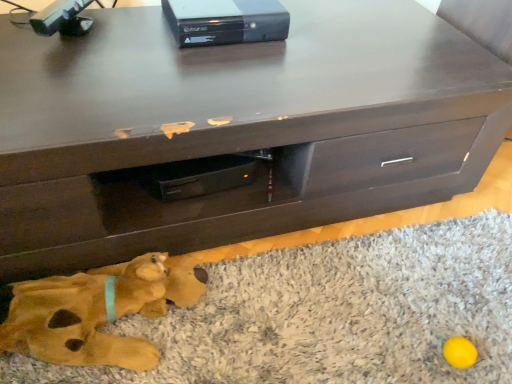
Locate an element on the screen. This screenshot has height=384, width=512. dark wood chest of drawers at center is located at coordinates (234, 128).

This screenshot has width=512, height=384. I want to click on soft plush dog at lower left, so click(96, 313).

Considering the sizes of objects soft plush dog at lower left and black plastic game console at upper center in the image provided, who is smaller, soft plush dog at lower left or black plastic game console at upper center?

With smaller size is black plastic game console at upper center.

From a real-world perspective, who is located lower, soft plush dog at lower left or black plastic game console at upper center?

From a 3D spatial view, soft plush dog at lower left is below.

In the scene shown: How many degrees apart are the facing directions of soft plush dog at lower left and black plastic game console at upper center?

There is a 1.21-degree angle between the facing directions of soft plush dog at lower left and black plastic game console at upper center.

From the image's perspective, between soft plush dog at lower left and black plastic game console at upper center, who is located below?

soft plush dog at lower left appears lower in the image.

Based on the photo, is soft plush rug at lower center further to camera compared to soft plush dog at lower left?

No.

From the image's perspective, which one is positioned lower, soft plush rug at lower center or soft plush dog at lower left?

soft plush rug at lower center, from the image's perspective.

How many degrees apart are the facing directions of soft plush rug at lower center and soft plush dog at lower left?

The angular difference between soft plush rug at lower center and soft plush dog at lower left is 88.7 degrees.

Is soft plush rug at lower center taller or shorter than soft plush dog at lower left?

soft plush rug at lower center is shorter than soft plush dog at lower left.

Can you tell me how much soft plush dog at lower left and soft plush rug at lower center differ in facing direction?

The angle between the facing direction of soft plush dog at lower left and the facing direction of soft plush rug at lower center is 88.7 degrees.

Based on their positions, is soft plush dog at lower left located to the left or right of soft plush rug at lower center?

soft plush dog at lower left is to the left of soft plush rug at lower center.

Based on the photo, from a real-world perspective, relative to soft plush rug at lower center, is soft plush dog at lower left vertically above or below?

soft plush dog at lower left is situated higher than soft plush rug at lower center in the real world.

Between soft plush dog at lower left and soft plush rug at lower center, which one has smaller width?

soft plush dog at lower left.

Is black plastic game console at upper center taller than soft plush dog at lower left?

Incorrect, the height of black plastic game console at upper center is not larger of that of soft plush dog at lower left.

Is black plastic game console at upper center outside of soft plush dog at lower left?

Absolutely, black plastic game console at upper center is external to soft plush dog at lower left.

In the scene shown: Does black plastic game console at upper center have a greater width compared to soft plush dog at lower left?

Correct, the width of black plastic game console at upper center exceeds that of soft plush dog at lower left.

Between black plastic game console at upper center and soft plush dog at lower left, which one has larger size?

soft plush dog at lower left.

Which object is positioned more to the right, soft plush dog at lower left or dark wood chest of drawers at center?

dark wood chest of drawers at center.

Measure the distance between soft plush dog at lower left and dark wood chest of drawers at center.

soft plush dog at lower left and dark wood chest of drawers at center are 13.71 inches apart.

From a real-world perspective, is soft plush dog at lower left physically above dark wood chest of drawers at center?

Incorrect, from a real-world perspective, soft plush dog at lower left is lower than dark wood chest of drawers at center.

Is the position of soft plush dog at lower left more distant than that of dark wood chest of drawers at center?

Yes.

Choose the correct answer: Is black plastic game console at upper center inside soft plush rug at lower center or outside it?

black plastic game console at upper center is not inside soft plush rug at lower center, it's outside.

Is the position of black plastic game console at upper center less distant than that of soft plush rug at lower center?

No, black plastic game console at upper center is behind soft plush rug at lower center.

From a real-world perspective, is black plastic game console at upper center positioned above or below soft plush rug at lower center?

black plastic game console at upper center is situated higher than soft plush rug at lower center in the real world.

Considering the relative sizes of black plastic game console at upper center and soft plush rug at lower center in the image provided, is black plastic game console at upper center thinner than soft plush rug at lower center?

Indeed, black plastic game console at upper center has a lesser width compared to soft plush rug at lower center.

Is dark wood chest of drawers at center not close to soft plush dog at lower left?

dark wood chest of drawers at center is near soft plush dog at lower left, not far away.

Looking at this image, from the image's perspective, which object appears higher, dark wood chest of drawers at center or soft plush dog at lower left?

dark wood chest of drawers at center, from the image's perspective.

Does dark wood chest of drawers at center turn towards soft plush dog at lower left?

Yes, dark wood chest of drawers at center is turned towards soft plush dog at lower left.

Is dark wood chest of drawers at center at the left side of soft plush dog at lower left?

No.

This screenshot has height=384, width=512. In the image, there is a soft plush dog at lower left. Find the location of `equipment above it (from the image's perspective)`. equipment above it (from the image's perspective) is located at coordinates (225, 21).

Locate an element on the screen. This screenshot has height=384, width=512. mat to the right of soft plush dog at lower left is located at coordinates (332, 314).

Based on their spatial positions, is black plastic game console at upper center or soft plush dog at lower left closer to soft plush rug at lower center?

soft plush dog at lower left is closer to soft plush rug at lower center.

Based on their spatial positions, is black plastic game console at upper center or soft plush rug at lower center closer to soft plush dog at lower left?

The object closer to soft plush dog at lower left is soft plush rug at lower center.

Which object lies nearer to the anchor point soft plush dog at lower left, soft plush rug at lower center or black plastic game console at upper center?

soft plush rug at lower center is positioned closer to the anchor soft plush dog at lower left.

When comparing their distances from dark wood chest of drawers at center, does soft plush rug at lower center or soft plush dog at lower left seem closer?

soft plush rug at lower center.

Considering their positions, is dark wood chest of drawers at center positioned further to soft plush dog at lower left than black plastic game console at upper center?

Among the two, black plastic game console at upper center is located further to soft plush dog at lower left.

Based on their spatial positions, is dark wood chest of drawers at center or soft plush dog at lower left further from black plastic game console at upper center?

The object further to black plastic game console at upper center is soft plush dog at lower left.

When comparing their distances from soft plush rug at lower center, does soft plush dog at lower left or black plastic game console at upper center seem closer?

soft plush dog at lower left.

Based on the photo, estimate the real-world distances between objects in this image. Which object is closer to soft plush dog at lower left, soft plush rug at lower center or dark wood chest of drawers at center?

Among the two, soft plush rug at lower center is located nearer to soft plush dog at lower left.

Locate an element on the screen. the chest of drawers between black plastic game console at upper center and soft plush rug at lower center vertically is located at coordinates (234, 128).

In order to click on animal between black plastic game console at upper center and soft plush rug at lower center in the up-down direction in this screenshot , I will do `click(96, 313)`.

Identify the location of chest of drawers between black plastic game console at upper center and soft plush dog at lower left from top to bottom. Image resolution: width=512 pixels, height=384 pixels. (234, 128).

Identify the location of animal between dark wood chest of drawers at center and soft plush rug at lower center vertically. (96, 313).